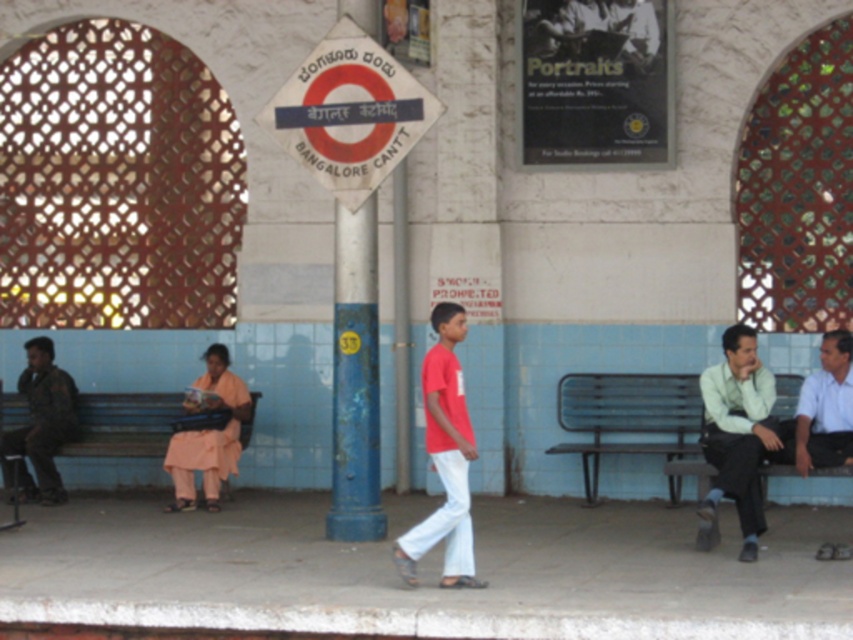
You are standing at the point marked by the coordinates point (123, 424) in the image. What object are you standing on?

The point (123, 424) marks the blue painted wood bench at center left, so you are standing on the blue painted wood bench at center left.

You are standing on the platform and want to sit down. There is a metallic park bench at right and a blue painted wood bench at center left. Which bench is closer to you?

The metallic park bench at right is closer to the viewer than the blue painted wood bench at center left.

You are a photographer trying to capture a photo of the red matte shirt at center and the blue painted wood bench at center left. Which object should you focus on first if you want to ensure both are in focus, considering their sizes?

The blue painted wood bench at center left is thicker than the red matte shirt at center, so focusing on the larger object first would help ensure both are in focus.